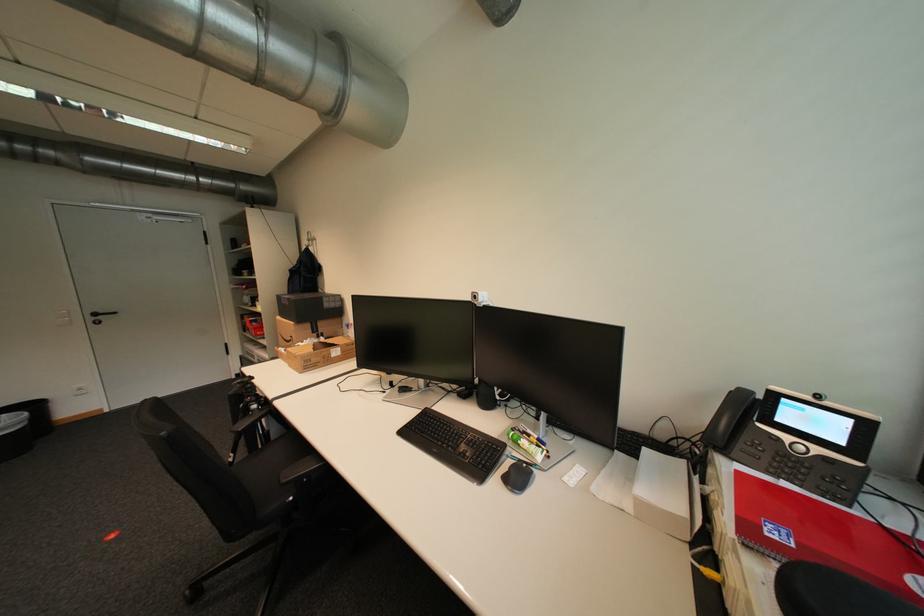
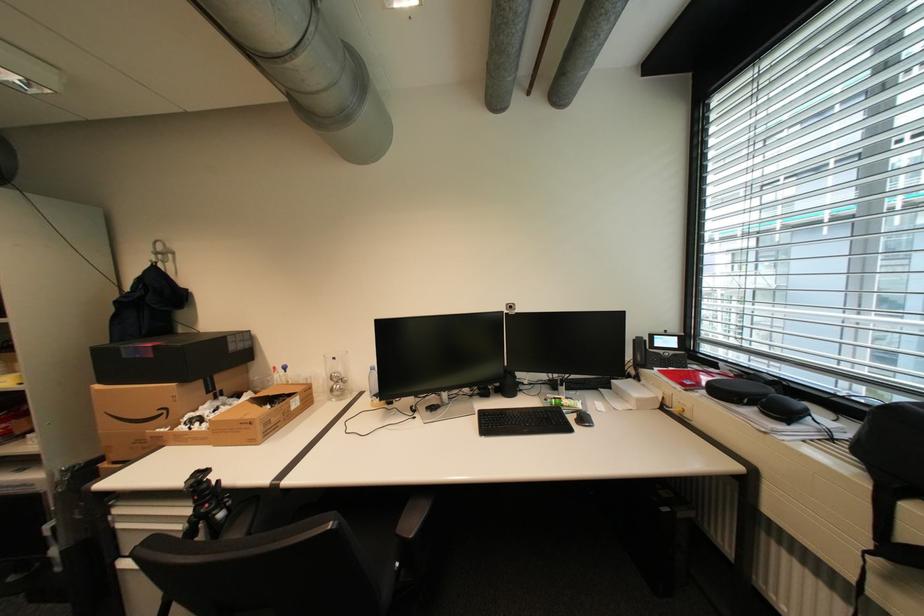
Locate, in the second image, the point that corresponds to pixel 317 241 in the first image.

(165, 254)